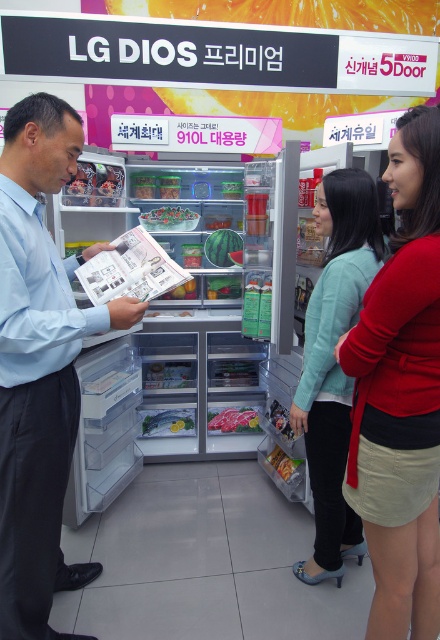
Question: Based on their relative distances, which object is farther from the meat sliced raw at center?

Choices:
 (A) shiny plastic snack at center
 (B) light blue shirt at left

Answer: (B)

Question: From the image, what is the correct spatial relationship of green matte watermelon at center in relation to meat sliced raw at center?

Choices:
 (A) below
 (B) above

Answer: (B)

Question: Which point is closer to the camera taking this photo?

Choices:
 (A) (245, 428)
 (B) (411, 323)

Answer: (B)

Question: Does light blue sweater at center have a larger size compared to shiny silver fish at center?

Choices:
 (A) yes
 (B) no

Answer: (A)

Question: Can you confirm if light blue sweater at center is wider than meat sliced raw at center?

Choices:
 (A) yes
 (B) no

Answer: (A)

Question: Among these points, which one is farthest from the camera?

Choices:
 (A) (165, 205)
 (B) (145, 410)
 (C) (433, 461)

Answer: (A)